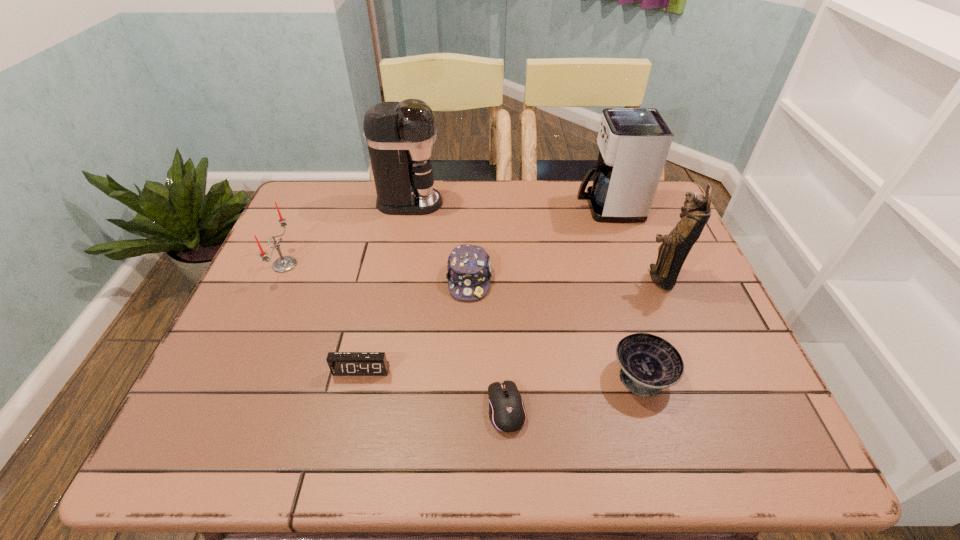
You are a GUI agent. You are given a task and a screenshot of the screen. Output one action in this format:
    pyautogui.click(x=<x>, y=<y>)
    Task: Click on the vacant space in between the alarm clock and the left coffee maker
    
    Given the screenshot: What is the action you would take?
    [x=385, y=286]

The height and width of the screenshot is (540, 960). In order to click on unoccupied position between the alarm clock and the figurine in this screenshot , I will do `click(511, 324)`.

At what (x,y) coordinates should I click in order to perform the action: click on empty location between the alarm clock and the computer mouse. Please return your answer as a coordinate pair (x, y). Image resolution: width=960 pixels, height=540 pixels. Looking at the image, I should click on (434, 389).

Where is `object that is the sixth nearest to the headwear`? The width and height of the screenshot is (960, 540). object that is the sixth nearest to the headwear is located at coordinates (672, 253).

Select which object is the fifth closest to the headwear. Please provide its 2D coordinates. Your answer should be formatted as a tuple, i.e. [(x, y)], where the tuple contains the x and y coordinates of a point satisfying the conditions above.

[(634, 143)]

Find the location of `vacant space that satisfies the following two spatial constraints: 1. on the front panel of the right coffee maker; 2. on the front side of the bowl`. vacant space that satisfies the following two spatial constraints: 1. on the front panel of the right coffee maker; 2. on the front side of the bowl is located at coordinates (665, 375).

This screenshot has width=960, height=540. What are the coordinates of `vacant area that satisfies the following two spatial constraints: 1. place cup under the spout of the bowl; 2. on the left side of the left coffee maker` in the screenshot? It's located at (376, 375).

The width and height of the screenshot is (960, 540). Find the location of `vacant space that satisfies the following two spatial constraints: 1. on the front-facing side of the headwear; 2. on the right side of the bowl`. vacant space that satisfies the following two spatial constraints: 1. on the front-facing side of the headwear; 2. on the right side of the bowl is located at coordinates (467, 375).

At what (x,y) coordinates should I click in order to perform the action: click on vacant space that satisfies the following two spatial constraints: 1. on the front-facing side of the figurine; 2. on the front-facing side of the alarm clock. Please return your answer as a coordinate pair (x, y). The width and height of the screenshot is (960, 540). Looking at the image, I should click on (697, 370).

This screenshot has height=540, width=960. In order to click on vacant position in the image that satisfies the following two spatial constraints: 1. place cup under the spout of the left coffee maker; 2. on the right side of the bowl in this screenshot , I will do `click(376, 375)`.